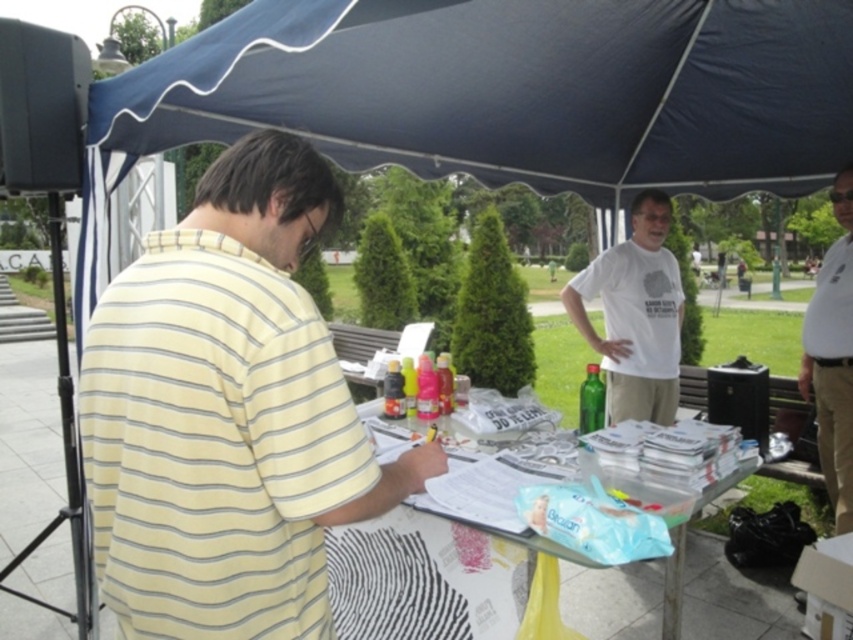
You are organizing an outdoor event and need to place a large banner on the table. The banner is as wide as the white plastic table at center. Can the yellow striped shirt at left, which is currently on the table, be placed next to the banner without overlapping?

The yellow striped shirt at left is narrower than the white plastic table at center. Since the banner is as wide as the table, there should be enough space next to it for the shirt without overlapping.

You are organizing a charity event and need to display two shirts on a rack. The rack has a height limit of 1.2 meters. You have the white cotton shirt at upper center and the white cotton polo shirt at right. Which shirt will exceed the height limit if placed on the rack?

The white cotton shirt at upper center is taller than the white cotton polo shirt at right, so it may exceed the 1.2 meters height limit if placed on the rack.